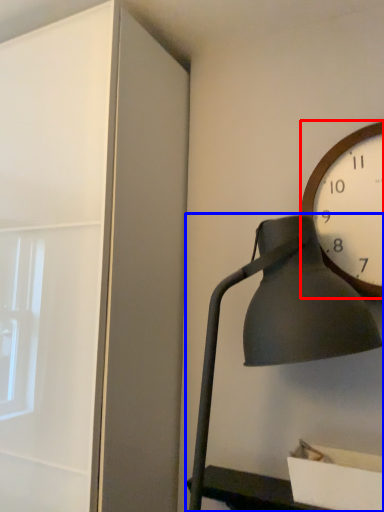
Question: Among these objects, which one is nearest to the camera, wall clock (highlighted by a red box) or lamp (highlighted by a blue box)?

Choices:
 (A) wall clock
 (B) lamp

Answer: (B)